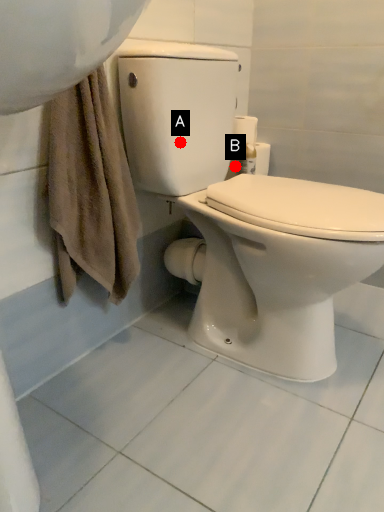
Question: Two points are circled on the image, labeled by A and B beside each circle. Which point is further to the camera?

Choices:
 (A) A is further
 (B) B is further

Answer: (B)